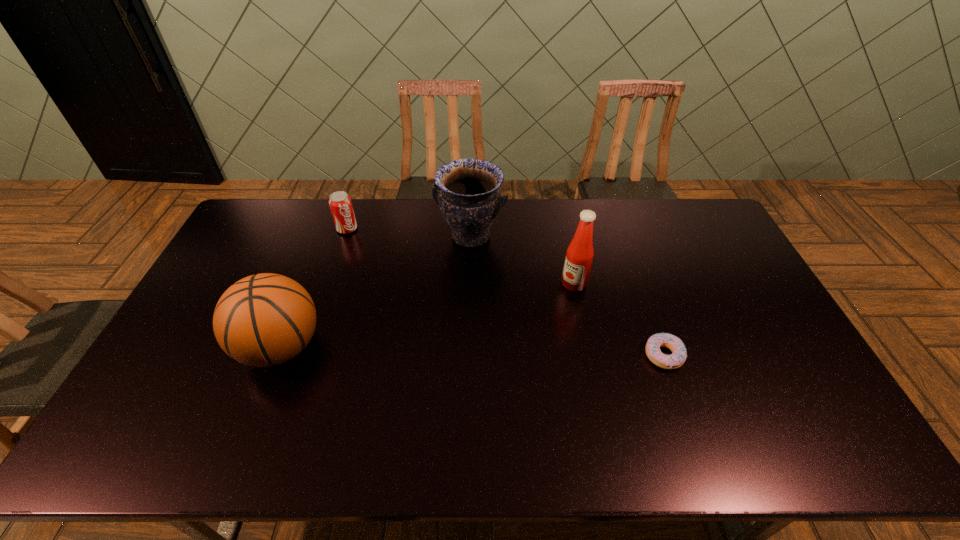
Find the location of a particular element. free space on the desktop that is between the basketball and the shortest object and is positioned on the front handle of the pottery is located at coordinates (420, 350).

I want to click on free space on the desktop that is between the basketball and the doughnut and is positioned on the logo side of the soda can, so click(446, 350).

Locate an element on the screen. The height and width of the screenshot is (540, 960). vacant spot on the desktop that is between the basketball and the doughnut and is positioned on the front-facing side of the fourth object from left to right is located at coordinates (499, 352).